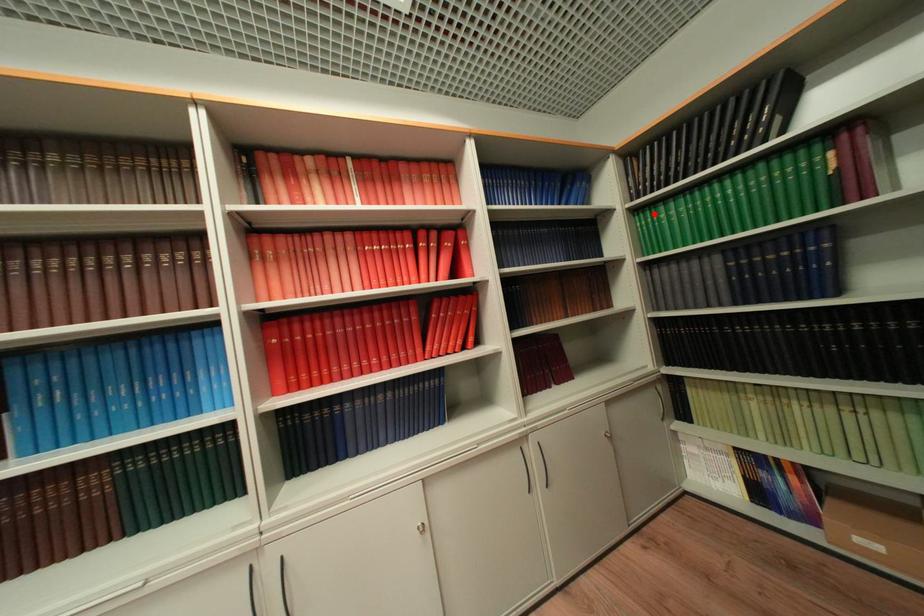
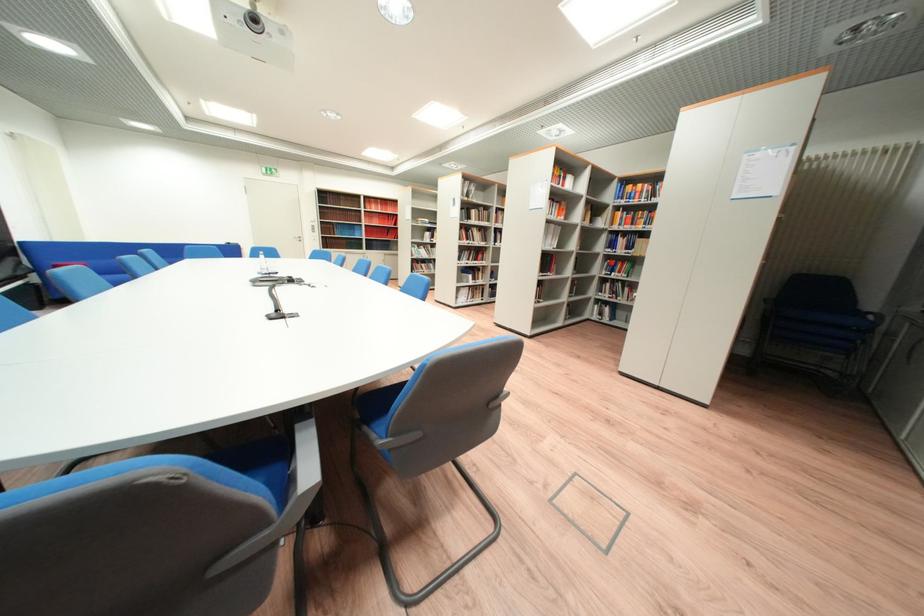
Question: I am providing you with two images of the same scene from different viewpoints. A red point is marked on the first image. At the location where the point appears in image 1, is it still visible in image 2?

Choices:
 (A) Yes
 (B) No

Answer: (B)